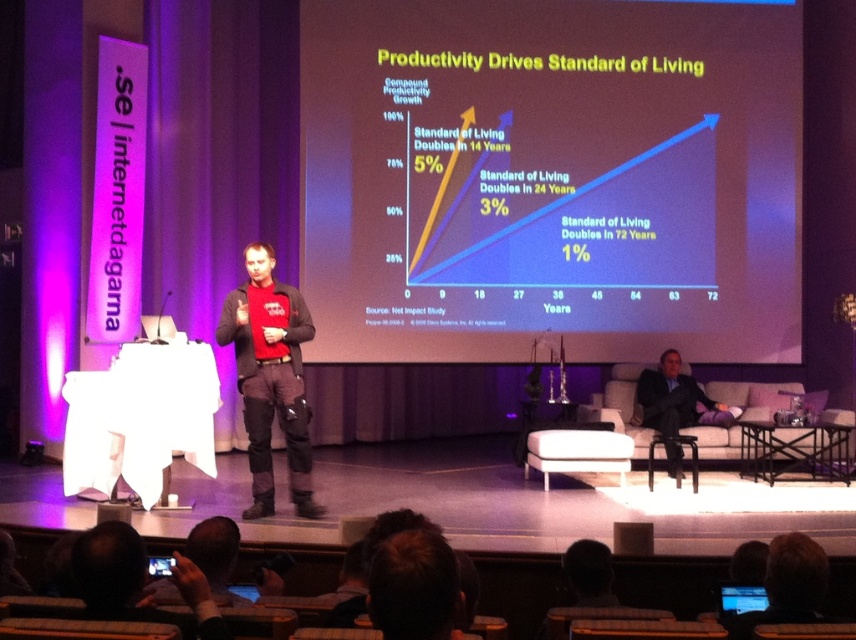
You are a stagehand holding a microphone stand that is 1.5 meters long. You need to place it between the matte red shirt at center and the dark suit at right so that it touches both. Is this possible?

The distance between the matte red shirt at center and the dark suit at right is 3.74 meters. Since the microphone stand is only 1.5 meters long, it cannot span the entire distance to touch both objects. Therefore, it is not possible to place the microphone stand between them while touching both.

You are an event coordinator planning to place a podium between the matte red shirt at center and the dark suit at right. Given their spatial relationship, where should the podium be placed to ensure it is closer to the larger object?

The dark suit at right is larger than the matte red shirt at center. Therefore, the podium should be placed closer to the dark suit at right to ensure it is nearer to the larger object.

You are an attendee at the presentation and want to take a photo of the graph on the large screen. However, there are two points of interest marked on the graph at coordinates point (282, 340) and point (730, 589). If you stand directly in front of the screen, which point will appear closer to you?

Point (282, 340) is behind point (730, 589), so the point (730, 589) will appear closer to you when standing in front of the screen.